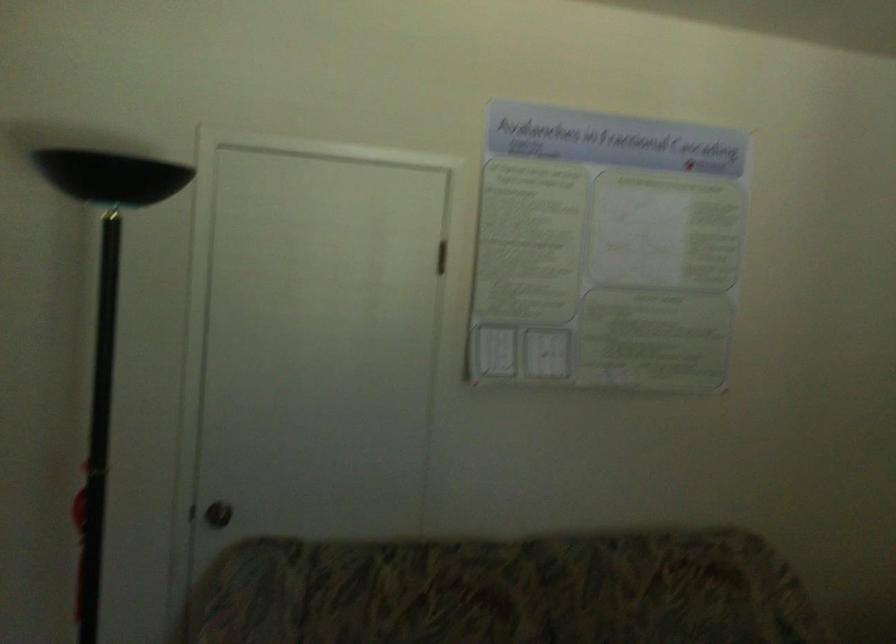
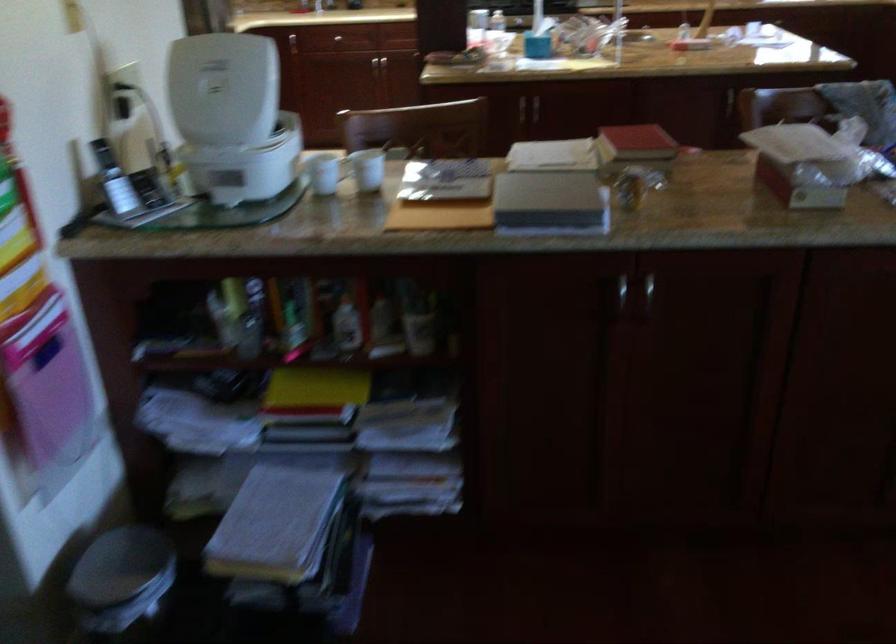
The first image is from the beginning of the video and the second image is from the end. How did the camera likely rotate when shooting the video?

→ The rotation direction of the camera is left-down.